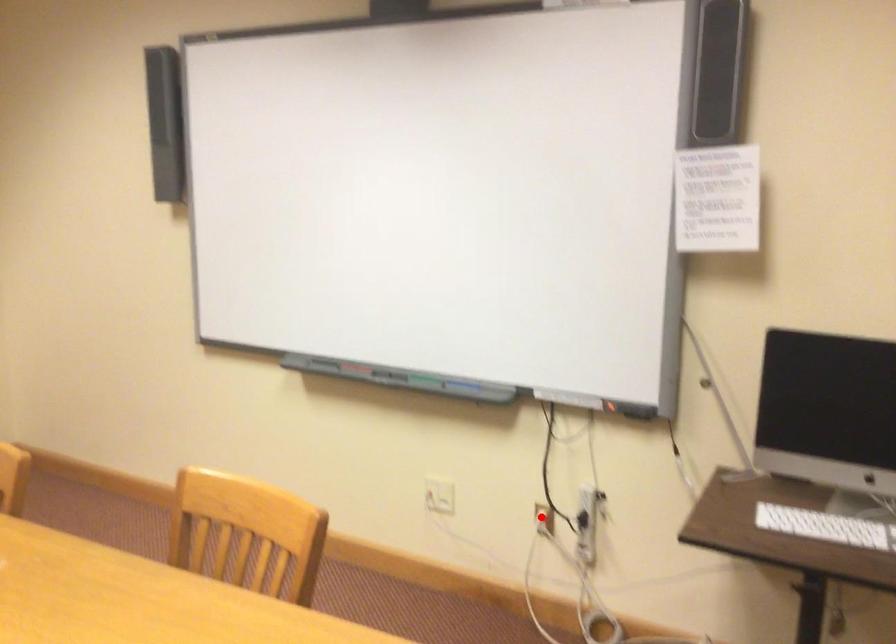
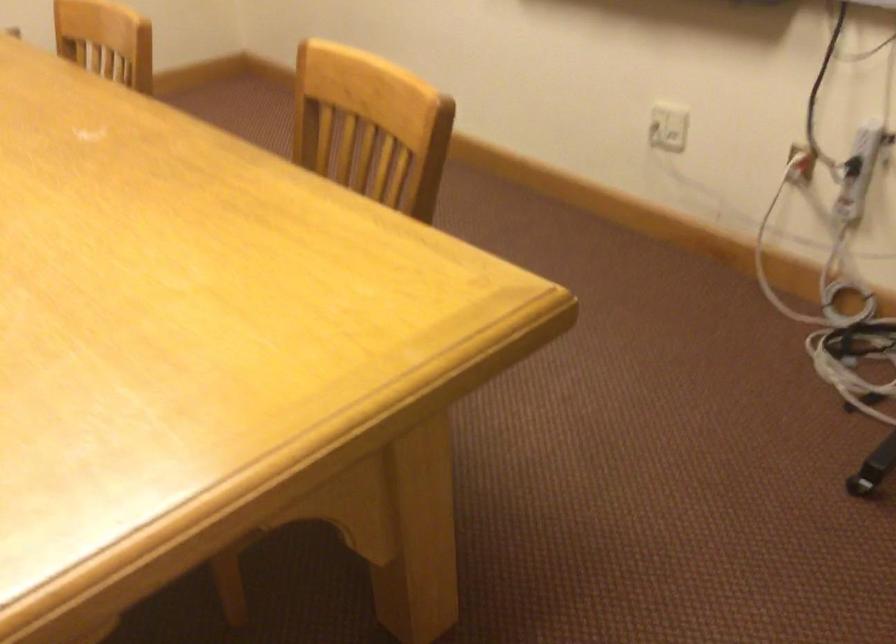
Find the pixel in the second image that matches the highlighted location in the first image.

(800, 164)